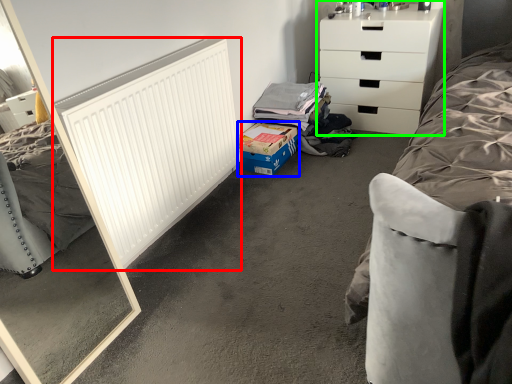
Question: Which is farther away from radiator (highlighted by a red box)? cardboard box (highlighted by a blue box) or chest of drawers (highlighted by a green box)?

Choices:
 (A) cardboard box
 (B) chest of drawers

Answer: (B)